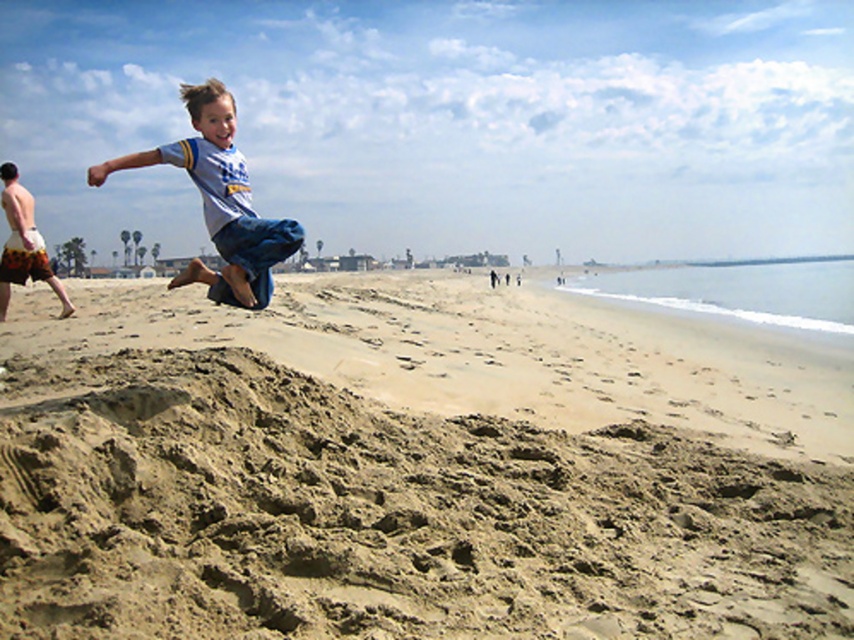
Question: Which point is closer to the camera taking this photo?

Choices:
 (A) (381, 420)
 (B) (291, 227)

Answer: (B)

Question: Does fine sand at center have a greater width compared to light blue denim shorts at center?

Choices:
 (A) no
 (B) yes

Answer: (B)

Question: Does fine sand at center lie behind light blue denim shorts at center?

Choices:
 (A) no
 (B) yes

Answer: (A)

Question: Which object appears farthest from the camera in this image?

Choices:
 (A) fine sand at center
 (B) light blue denim shorts at center

Answer: (B)

Question: Does fine sand at center come in front of light blue denim shorts at center?

Choices:
 (A) no
 (B) yes

Answer: (B)

Question: Among these objects, which one is nearest to the camera?

Choices:
 (A) light blue denim shorts at center
 (B) fine sand at center

Answer: (B)